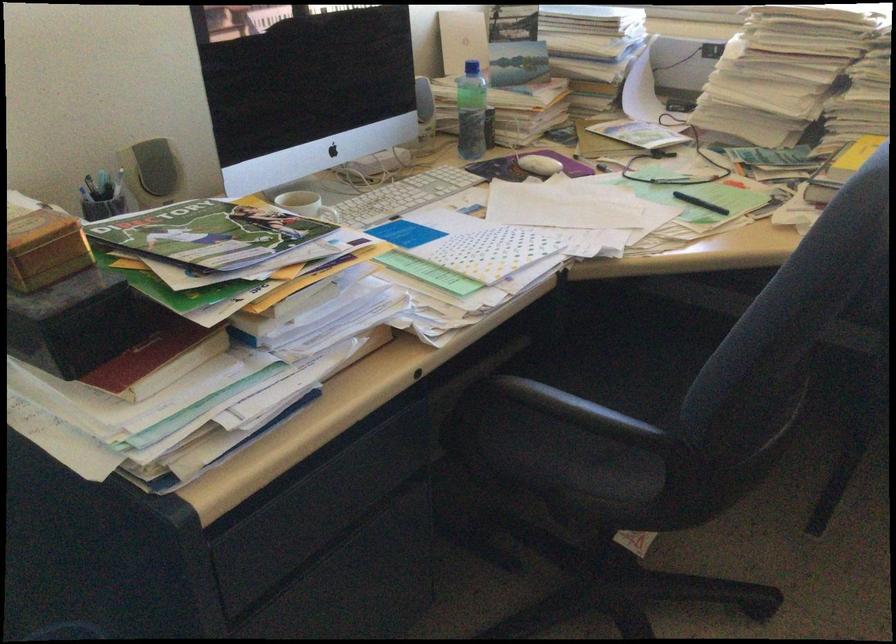
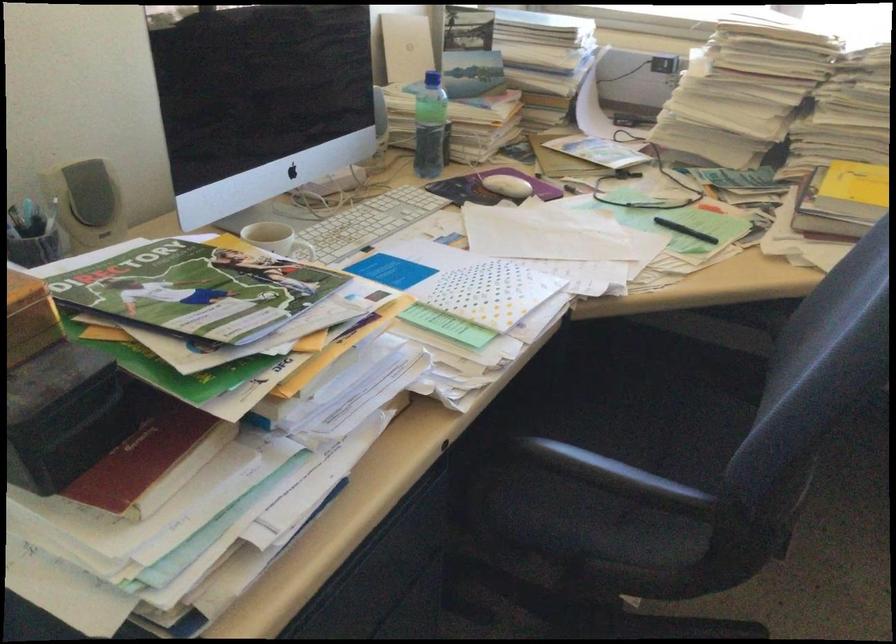
In the second image, find the point that corresponds to (x=661, y=371) in the first image.

(653, 411)